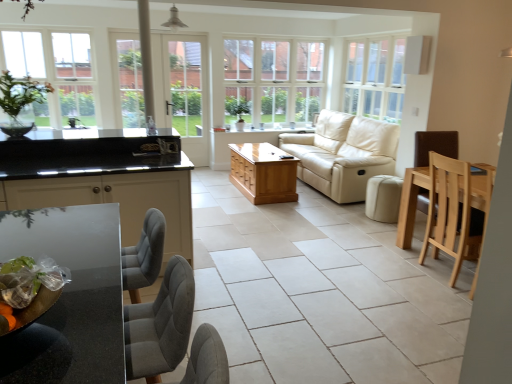
Question: From the image's perspective, is white glass screen door at center above or below beige leather couch at center?

Choices:
 (A) above
 (B) below

Answer: (A)

Question: Is point (176, 117) positioned closer to the camera than point (382, 160)?

Choices:
 (A) farther
 (B) closer

Answer: (A)

Question: Which is nearer to the clear glass window at upper left, the first window viewed from the left?

Choices:
 (A) white wood window at upper right, which appears as the third window when viewed from the left
 (B) light brown wooden coffee table at center
 (C) black glossy cabinet at left
 (D) beige leather couch at center
 (E) beige leather ottoman at center

Answer: (B)

Question: Based on their relative distances, which object is farther from the white glass screen door at center?

Choices:
 (A) light brown wooden coffee table at center
 (B) white wood window at upper right, the 1th window in the right-to-left sequence
 (C) beige leather couch at center
 (D) clear glass window at upper left, the third window from the right
 (E) beige leather ottoman at center

Answer: (E)